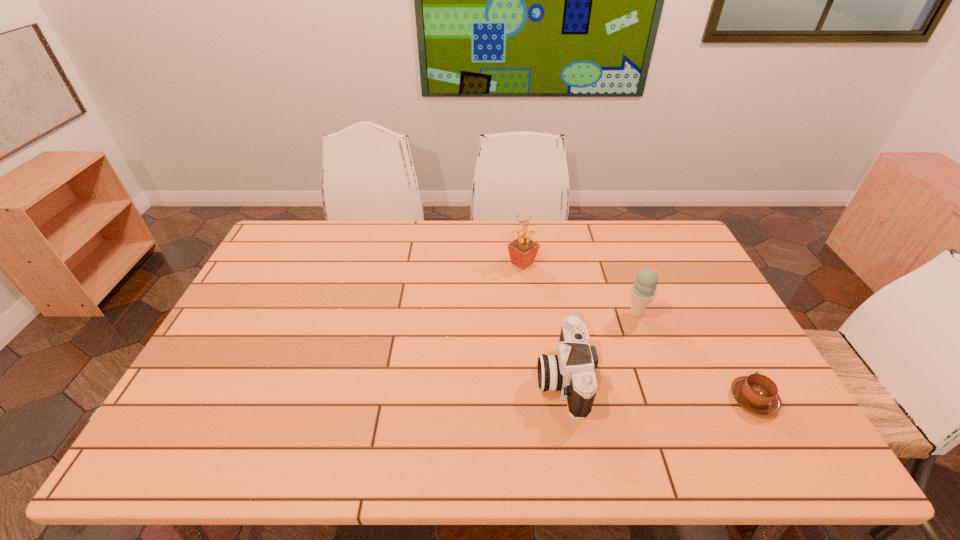
You are a GUI agent. You are given a task and a screenshot of the screen. Output one action in this format:
    pyautogui.click(x=<x>, y=<y>)
    Task: Click on the vacant space located 0.100m on the left of the camera
    The height and width of the screenshot is (540, 960).
    Given the screenshot: What is the action you would take?
    pyautogui.click(x=498, y=378)

Find the location of a particular element. The width and height of the screenshot is (960, 540). blank space located 0.300m on the side of the rightmost object with the handle is located at coordinates (699, 299).

Identify the location of vacant area located 0.340m on the side of the rightmost object with the handle. This screenshot has width=960, height=540. (694, 291).

Locate an element on the screen. vacant point located on the side of the rightmost object with the handle is located at coordinates (694, 291).

This screenshot has width=960, height=540. What are the coordinates of `object that is at the far edge` in the screenshot? It's located at (523, 250).

The height and width of the screenshot is (540, 960). Identify the location of object at the right edge. (757, 393).

In the image, there is a desktop. What are the coordinates of `free space at the far edge` in the screenshot? It's located at click(549, 227).

In the image, there is a desktop. Where is `vacant region at the near edge`? vacant region at the near edge is located at coordinates (460, 442).

In the image, there is a desktop. At what (x,y) coordinates should I click in order to perform the action: click on vacant area at the left edge. Please return your answer as a coordinate pair (x, y). The image size is (960, 540). Looking at the image, I should click on (276, 311).

At what (x,y) coordinates should I click in order to perform the action: click on free space at the right edge of the desktop. Please return your answer as a coordinate pair (x, y). This screenshot has height=540, width=960. Looking at the image, I should click on (690, 325).